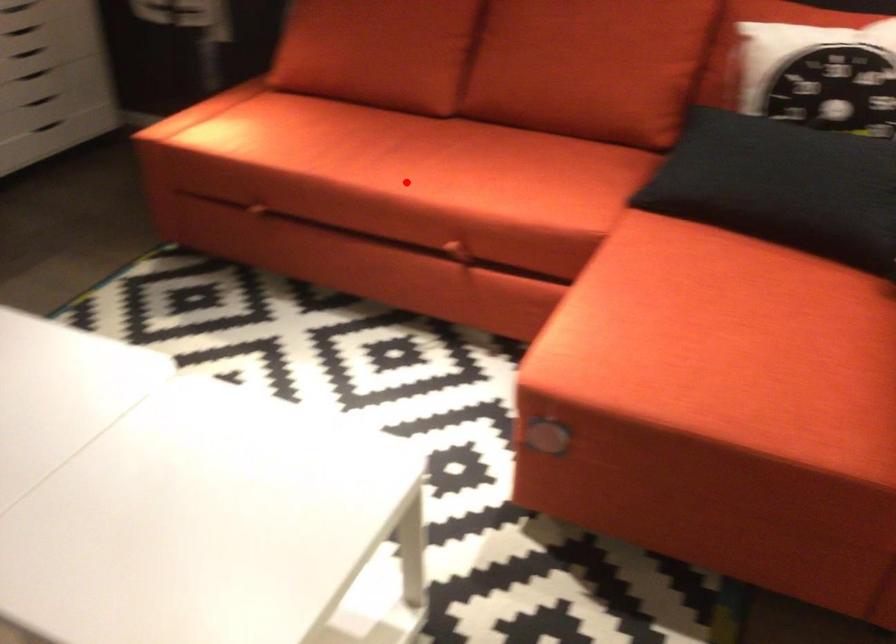
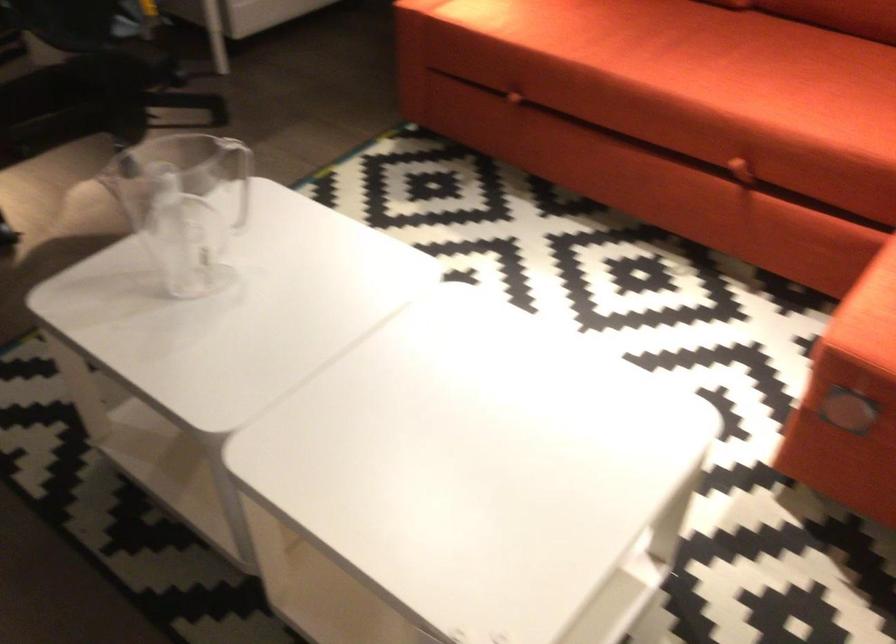
Question: I am providing you with two images of the same scene from different viewpoints. A red point is marked on the first image. Is the red point's position out of view in image 2?

Choices:
 (A) Yes
 (B) No

Answer: (B)